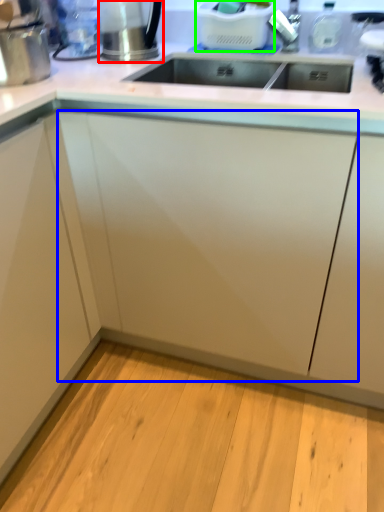
Question: Which object is the closest to the appliance (highlighted by a red box)? Choose among these: cabinetry (highlighted by a blue box) or appliance (highlighted by a green box).

Choices:
 (A) cabinetry
 (B) appliance

Answer: (B)